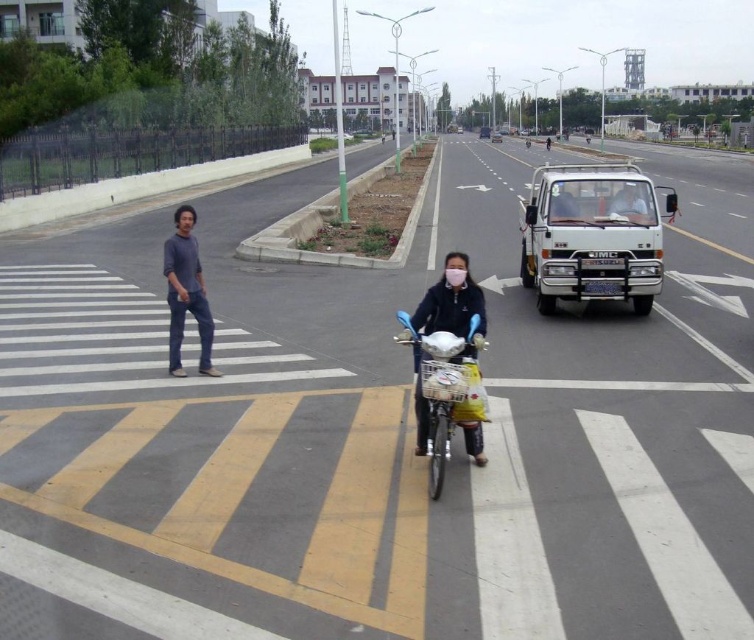
Does point (566, 228) come in front of point (189, 284)?

No, (566, 228) is behind (189, 284).

Can you confirm if white matte truck at center-right is wider than gray matte shirt at left?

Yes.

Find the location of a particular element. This screenshot has width=754, height=640. white matte truck at center-right is located at coordinates (590, 236).

Where is `white matte truck at center-right`? This screenshot has width=754, height=640. white matte truck at center-right is located at coordinates (590, 236).

Who is higher up, white matte truck at center-right or white glossy car at upper center?

white matte truck at center-right is above.

Is point (651, 227) farther from viewer compared to point (642, 216)?

No, it is in front of (642, 216).

Image resolution: width=754 pixels, height=640 pixels. What are the coordinates of `white matte truck at center-right` in the screenshot? It's located at (590, 236).

Is gray matte shirt at left above white matte truck at center?

Incorrect, gray matte shirt at left is not positioned above white matte truck at center.

Is gray matte shirt at left to the right of white matte truck at center from the viewer's perspective?

Incorrect, gray matte shirt at left is not on the right side of white matte truck at center.

I want to click on gray matte shirt at left, so click(x=185, y=292).

Find the location of a particular element. gray matte shirt at left is located at coordinates (185, 292).